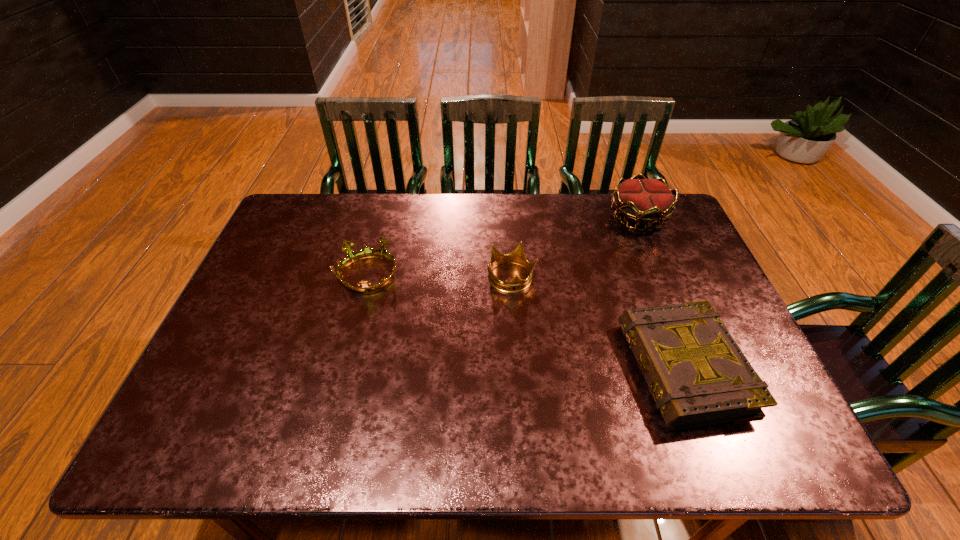
Find the location of `the farthest object`. the farthest object is located at coordinates (645, 201).

Where is `the tallest object`? Image resolution: width=960 pixels, height=540 pixels. the tallest object is located at coordinates (645, 201).

The height and width of the screenshot is (540, 960). I want to click on the second crown from right to left, so click(516, 284).

The image size is (960, 540). In order to click on the leftmost crown in this screenshot , I will do `click(352, 256)`.

Where is `hardback book`? The width and height of the screenshot is (960, 540). hardback book is located at coordinates (697, 374).

Image resolution: width=960 pixels, height=540 pixels. Identify the location of free location located 0.240m on the left of the tallest crown. [x=537, y=217].

Identify the location of vacant space located 0.170m on the left of the third object from right to left. (428, 278).

At what (x,y) coordinates should I click in order to perform the action: click on free region located 0.150m on the right of the leftmost object. Please return your answer as a coordinate pair (x, y). This screenshot has height=540, width=960. Looking at the image, I should click on (452, 275).

Locate an element on the screen. The image size is (960, 540). vacant space positioned 0.150m on the left of the nearest object is located at coordinates [564, 368].

Locate an element on the screen. object at the far edge is located at coordinates (645, 201).